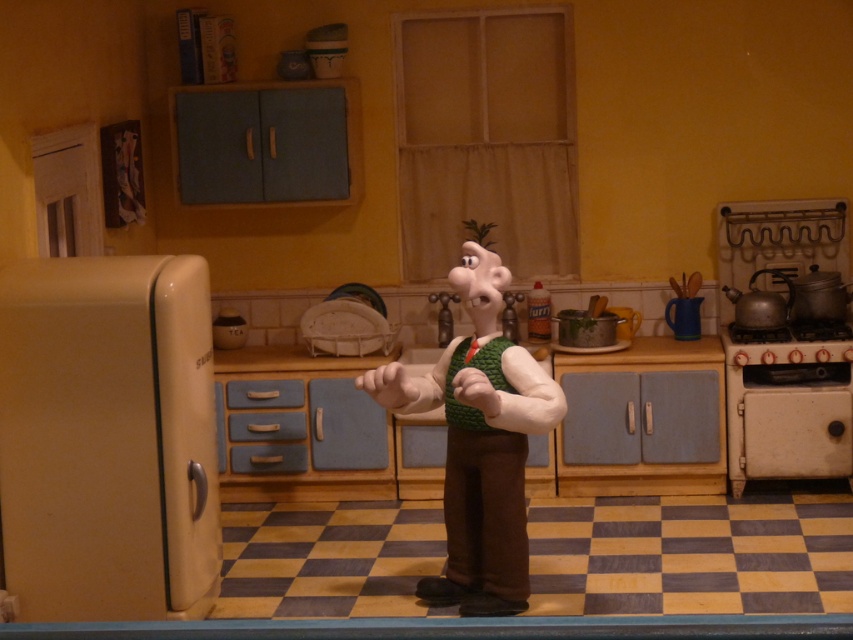
Measure the distance between beige matte refrigerator at left and camera.

15.27 feet

Image resolution: width=853 pixels, height=640 pixels. Describe the element at coordinates (108, 438) in the screenshot. I see `beige matte refrigerator at left` at that location.

Find the location of `beige matte refrigerator at left`. beige matte refrigerator at left is located at coordinates (108, 438).

In order to click on beige matte refrigerator at left in this screenshot , I will do `click(108, 438)`.